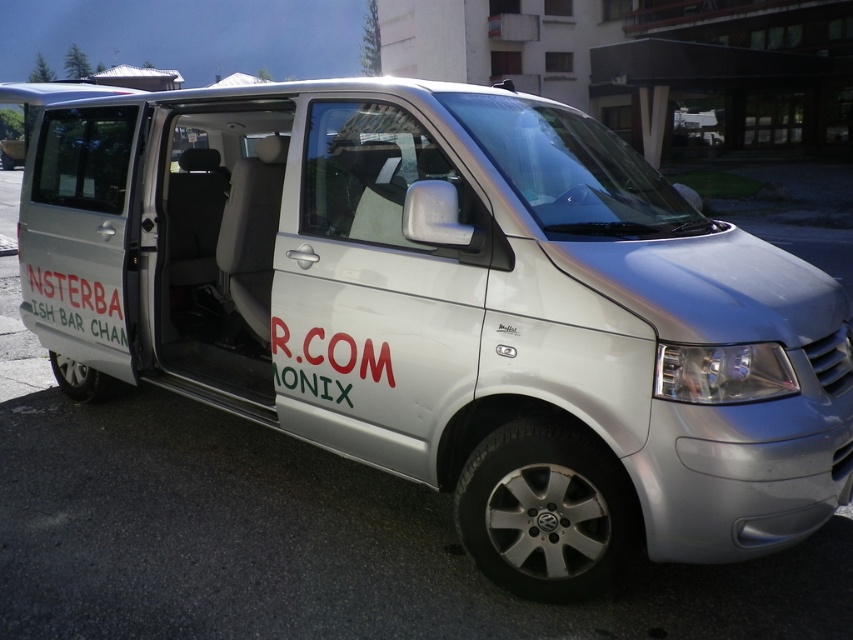
You are a delivery person who needs to place a package on the van. The package is 36 inches long. Can you fit it between the white matte door at center and the white painted text at side?

→ The distance between the white matte door at center and the white painted text at side is 35.83 inches. Since the package is 36 inches long, it is slightly too long to fit in the space provided.